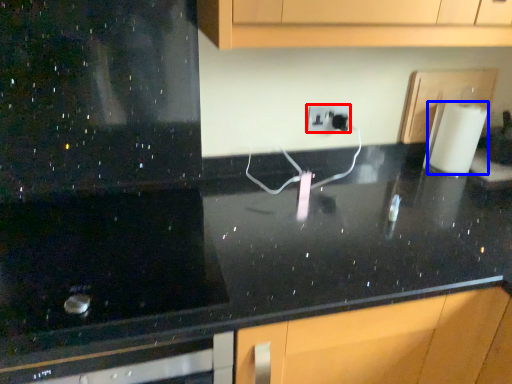
Question: Among these objects, which one is nearest to the camera, electric outlet (highlighted by a red box) or paper towel (highlighted by a blue box)?

Choices:
 (A) electric outlet
 (B) paper towel

Answer: (B)